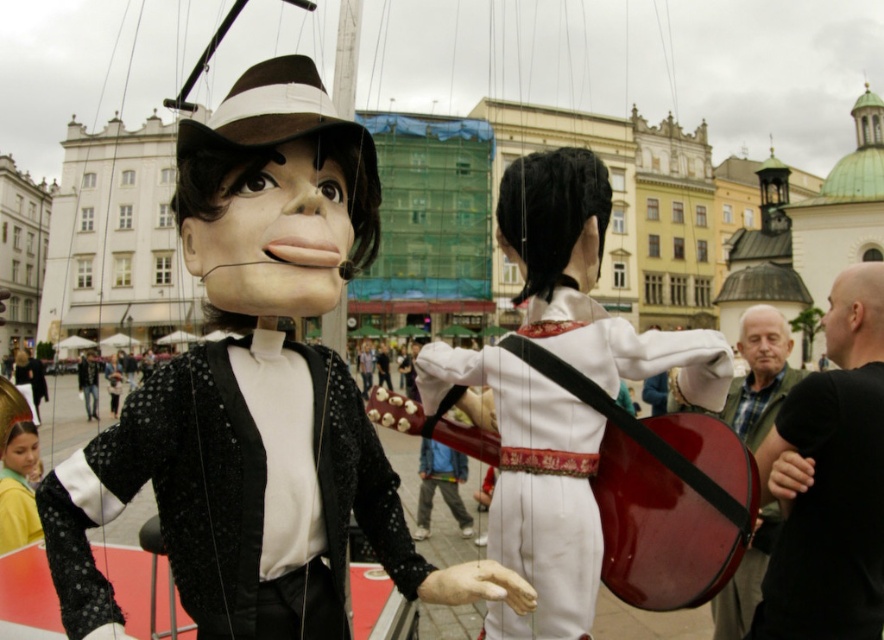
Question: Which point is farther to the camera?

Choices:
 (A) green plaid shirt at right
 (B) black sequined jacket at center

Answer: (A)

Question: Which is farther from the white matte guitar at center?

Choices:
 (A) black leather jacket at upper right
 (B) green plaid shirt at right

Answer: (B)

Question: Is black sequined jacket at center above green plaid shirt at right?

Choices:
 (A) yes
 (B) no

Answer: (B)

Question: Estimate the real-world distances between objects in this image. Which object is farther from the green plaid shirt at right?

Choices:
 (A) black sequined jacket at center
 (B) white matte guitar at center

Answer: (A)

Question: Where is black leather jacket at upper right located in relation to green plaid shirt at right in the image?

Choices:
 (A) right
 (B) left

Answer: (A)

Question: Does black sequined jacket at center have a smaller size compared to green plaid shirt at right?

Choices:
 (A) yes
 (B) no

Answer: (A)